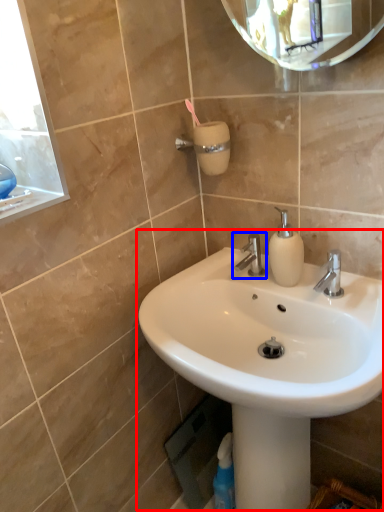
Question: Which object is closer to the camera taking this photo, sink (highlighted by a red box) or tap (highlighted by a blue box)?

Choices:
 (A) sink
 (B) tap

Answer: (A)